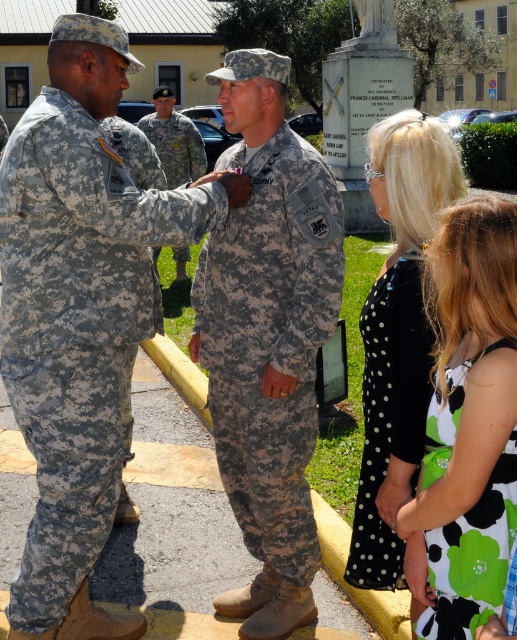
In the scene shown: You are a photographer at the military ceremony. You need to capture a photo that includes both the camouflage fabric uniform at center and the camouflage uniform at center. Which one should be placed on the left side in the photo to maintain their original positions?

The camouflage uniform at center should be placed on the left side in the photo because the camouflage fabric uniform at center is to the right of it.